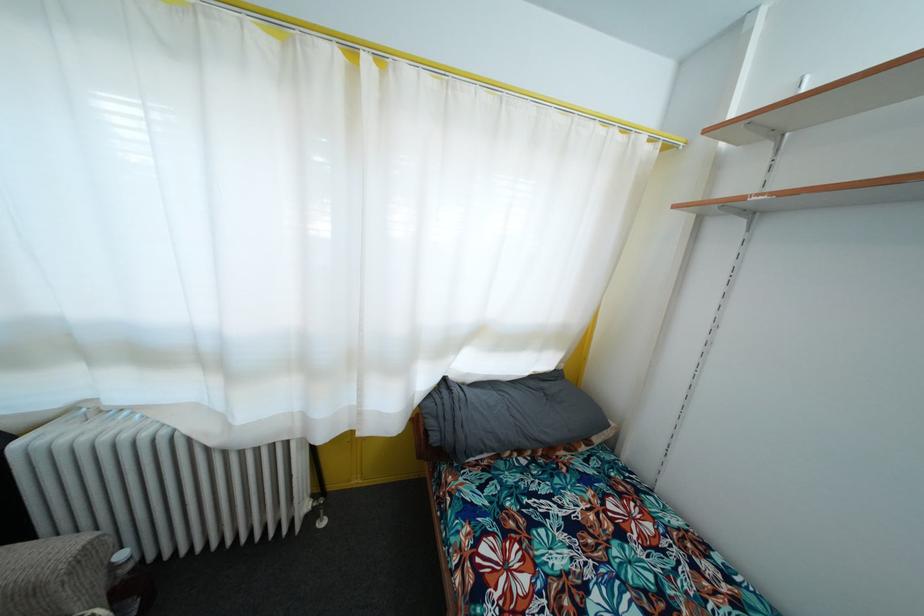
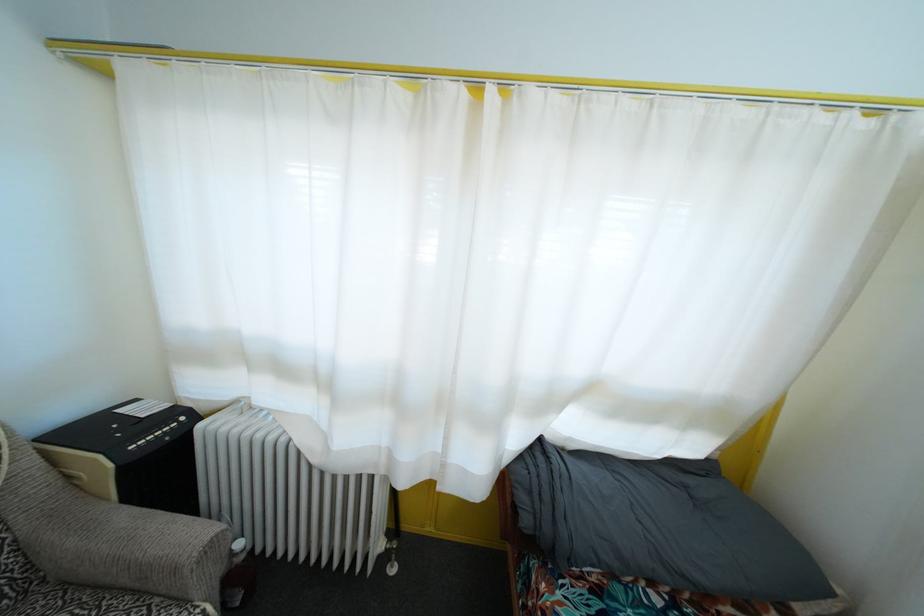
Question: The images are taken continuously from a first-person perspective. In which direction is your viewpoint rotating?

Choices:
 (A) Left
 (B) Right
 (C) Up
 (D) Down

Answer: (A)